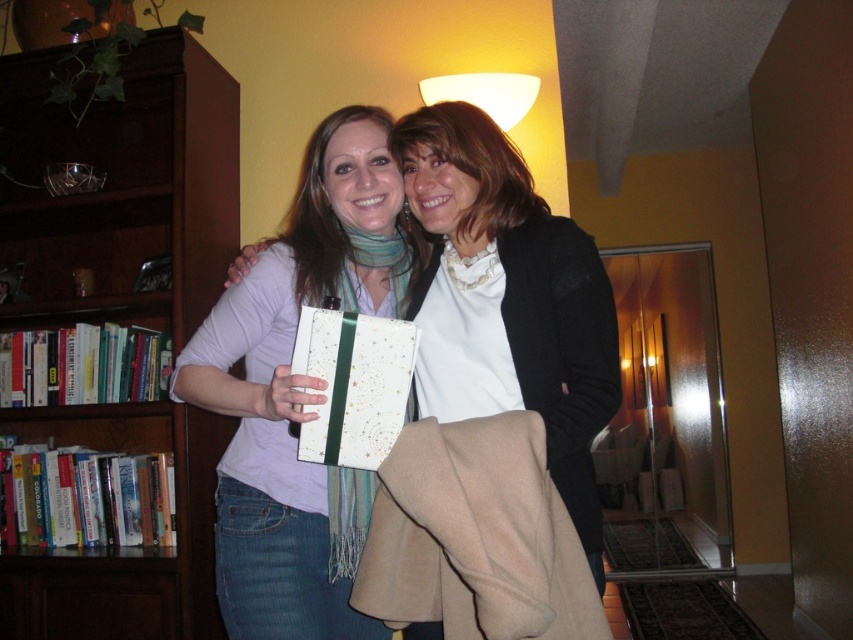
Is multicolored woven scarf at center in front of white matte lampshade at upper center?

That is True.

Who is positioned more to the left, multicolored woven scarf at center or white matte lampshade at upper center?

multicolored woven scarf at center is more to the left.

Image resolution: width=853 pixels, height=640 pixels. What do you see at coordinates (373, 268) in the screenshot?
I see `multicolored woven scarf at center` at bounding box center [373, 268].

I want to click on multicolored woven scarf at center, so click(x=373, y=268).

How far apart are white matte lampshade at upper center and multicolored knitted scarf at center?

A distance of 36.26 inches exists between white matte lampshade at upper center and multicolored knitted scarf at center.

Can you confirm if white matte lampshade at upper center is shorter than multicolored knitted scarf at center?

No.

Does point (480, 108) come behind point (341, 268)?

Yes, point (480, 108) is farther from viewer.

In order to click on white matte lampshade at upper center in this screenshot , I will do `click(485, 93)`.

Does point (494, 156) come closer to viewer compared to point (393, 289)?

Yes, point (494, 156) is closer to viewer.

Can you confirm if matte black jacket at center is bigger than multicolored woven scarf at center?

Incorrect, matte black jacket at center is not larger than multicolored woven scarf at center.

Image resolution: width=853 pixels, height=640 pixels. What are the coordinates of `matte black jacket at center` in the screenshot? It's located at (473, 163).

You are a GUI agent. You are given a task and a screenshot of the screen. Output one action in this format:
    pyautogui.click(x=<x>, y=<y>)
    Task: Click on the matte black jacket at center
    This screenshot has height=640, width=853.
    Given the screenshot: What is the action you would take?
    pyautogui.click(x=473, y=163)